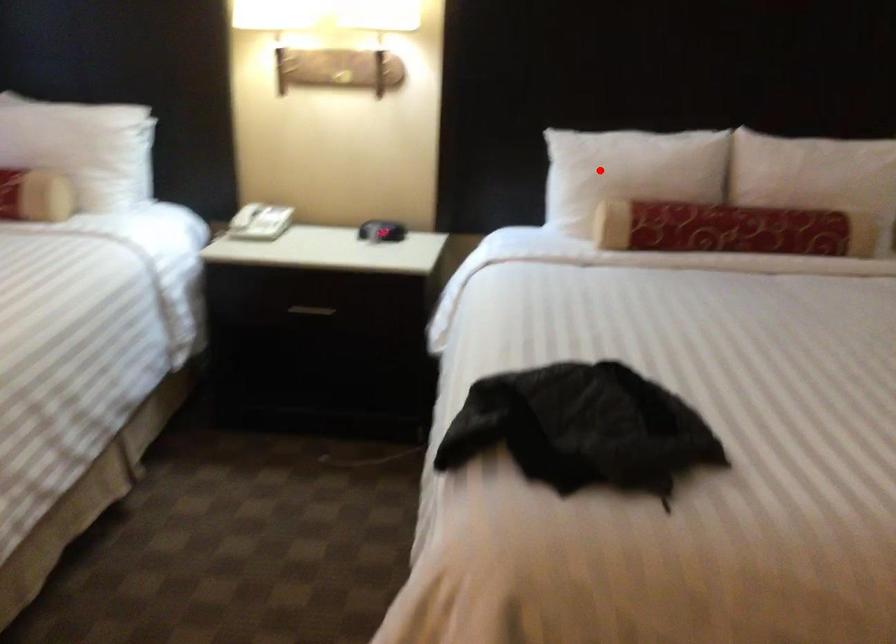
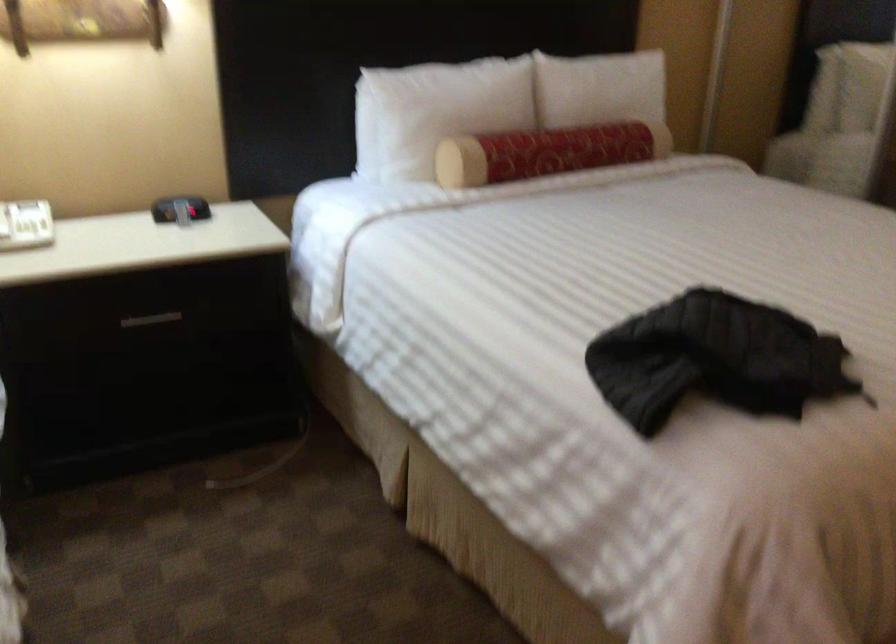
Find the pixel in the second image that matches the highlighted location in the first image.

(435, 111)